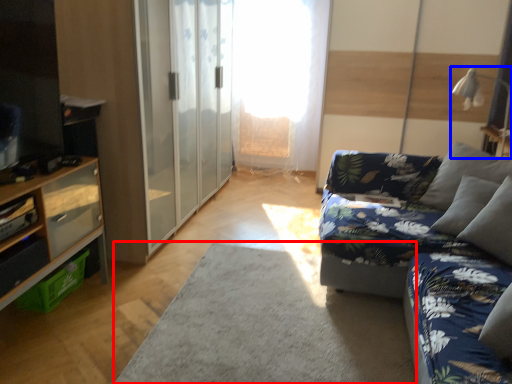
Question: Which point is closer to the camera, plain (highlighted by a red box) or lamp (highlighted by a blue box)?

Choices:
 (A) plain
 (B) lamp

Answer: (A)